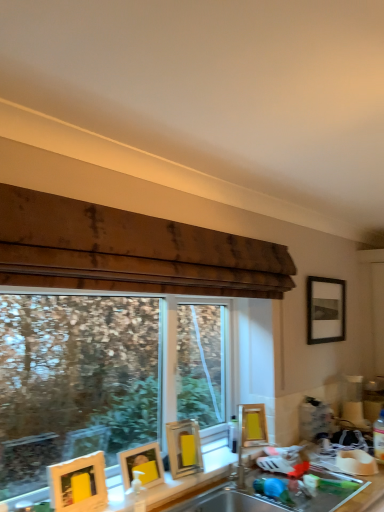
Question: Considering the positions of point (76, 473) and point (182, 459), is point (76, 473) closer or farther from the camera than point (182, 459)?

Choices:
 (A) closer
 (B) farther

Answer: (A)

Question: Looking at the image, does matte yellow picture frame at lower left, which is counted as the fifth picture frame, starting from the back, seem bigger or smaller compared to yellow matte picture frame at lower center, the third picture frame viewed from the left?

Choices:
 (A) big
 (B) small

Answer: (B)

Question: Based on their relative distances, which object is farther from the matte silver sink at center, which is the second sink in bottom-to-top order?

Choices:
 (A) matte yellow picture frame at lower left, the 1th picture frame positioned from the front
 (B) transparent glass window at center
 (C) black matte picture frame at upper right, the 1th picture frame positioned from the right
 (D) stainless steel sink at lower center, placed as the 1th sink when sorted from bottom to top
 (E) matte gold picture frame at lower left, which is the 4th picture frame in right-to-left order

Answer: (B)

Question: Which of these objects is positioned closest to the black matte picture frame at upper right, the 1th picture frame positioned from the right?

Choices:
 (A) yellow matte picture frame at center, placed as the 2th picture frame when sorted from right to left
 (B) stainless steel sink at lower center, placed as the second sink when sorted from top to bottom
 (C) matte yellow picture frame at lower left, marked as the 5th picture frame in a right-to-left arrangement
 (D) matte silver sink at center, which is the second sink in bottom-to-top order
 (E) transparent glass window at center

Answer: (A)